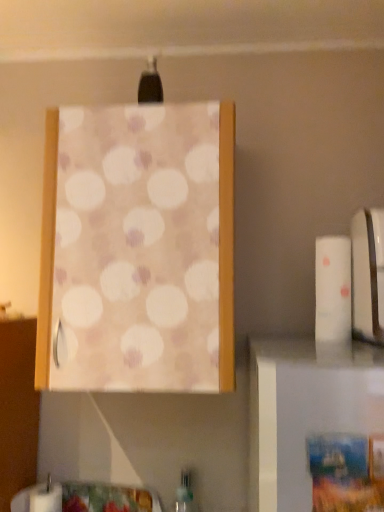
Question: Considering the relative sizes of white glossy toaster at right and green translucent bottle at lower center in the image provided, is white glossy toaster at right thinner than green translucent bottle at lower center?

Choices:
 (A) yes
 (B) no

Answer: (B)

Question: Does white glossy toaster at right lie behind green translucent bottle at lower center?

Choices:
 (A) no
 (B) yes

Answer: (A)

Question: Is white glossy toaster at right facing away from green translucent bottle at lower center?

Choices:
 (A) yes
 (B) no

Answer: (B)

Question: Does white glossy toaster at right have a larger size compared to green translucent bottle at lower center?

Choices:
 (A) yes
 (B) no

Answer: (A)

Question: From a real-world perspective, is white glossy toaster at right on top of green translucent bottle at lower center?

Choices:
 (A) no
 (B) yes

Answer: (B)

Question: Is green translucent bottle at lower center bigger or smaller than white matte toilet paper at right?

Choices:
 (A) big
 (B) small

Answer: (A)

Question: Is point (182, 508) positioned closer to the camera than point (319, 257)?

Choices:
 (A) closer
 (B) farther

Answer: (B)

Question: From the image's perspective, is green translucent bottle at lower center located above or below white matte toilet paper at right?

Choices:
 (A) below
 (B) above

Answer: (A)

Question: Looking at their shapes, would you say green translucent bottle at lower center is wider or thinner than white matte toilet paper at right?

Choices:
 (A) wide
 (B) thin

Answer: (B)

Question: Is matte fabric curtain at upper center situated inside green translucent bottle at lower center or outside?

Choices:
 (A) outside
 (B) inside

Answer: (A)

Question: Is matte fabric curtain at upper center taller or shorter than green translucent bottle at lower center?

Choices:
 (A) short
 (B) tall

Answer: (B)

Question: In terms of size, does matte fabric curtain at upper center appear bigger or smaller than green translucent bottle at lower center?

Choices:
 (A) small
 (B) big

Answer: (B)

Question: From the image's perspective, is matte fabric curtain at upper center located above or below green translucent bottle at lower center?

Choices:
 (A) above
 (B) below

Answer: (A)

Question: Based on their sizes in the image, would you say matte fabric curtain at upper center is bigger or smaller than white matte toilet paper at right?

Choices:
 (A) big
 (B) small

Answer: (A)

Question: Based on their positions, is matte fabric curtain at upper center located to the left or right of white matte toilet paper at right?

Choices:
 (A) left
 (B) right

Answer: (A)